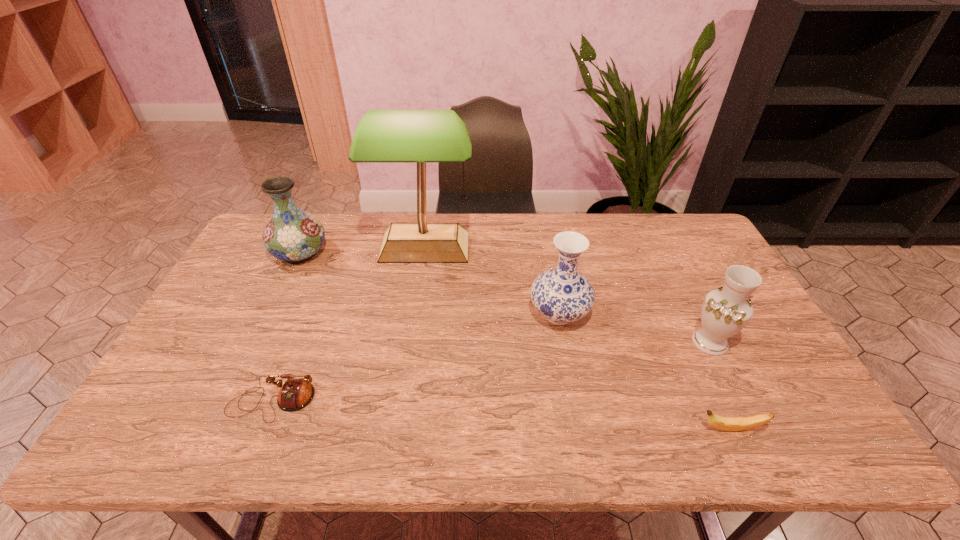
The width and height of the screenshot is (960, 540). In order to click on free space that is in between the second vase from right to left and the leftmost vase in this screenshot , I will do `click(430, 284)`.

Find the location of a particular element. vacant region between the rightmost vase and the second nearest object is located at coordinates (492, 372).

Locate an element on the screen. The width and height of the screenshot is (960, 540). free space between the banana and the fifth farthest object is located at coordinates (502, 415).

You are a GUI agent. You are given a task and a screenshot of the screen. Output one action in this format:
    pyautogui.click(x=<x>, y=<y>)
    Task: Click on the vacant area that lies between the second vase from left to right and the nearest object
    
    Given the screenshot: What is the action you would take?
    pyautogui.click(x=644, y=372)

This screenshot has height=540, width=960. In order to click on free spot between the rightmost vase and the nearest object in this screenshot , I will do `click(720, 386)`.

Identify the location of free space between the nearest object and the leftmost vase. (516, 341).

Identify the location of vacant area that lies between the farthest vase and the fourth object from left to right. (430, 284).

Locate an element on the screen. object that can be found as the third closest to the rightmost vase is located at coordinates (421, 136).

Select which object is the fourth closest to the banana. Please provide its 2D coordinates. Your answer should be formatted as a tuple, i.e. [(x, y)], where the tuple contains the x and y coordinates of a point satisfying the conditions above.

[(295, 394)]

Select which vase appears as the second closest to the farthest vase. Please provide its 2D coordinates. Your answer should be formatted as a tuple, i.e. [(x, y)], where the tuple contains the x and y coordinates of a point satisfying the conditions above.

[(725, 311)]